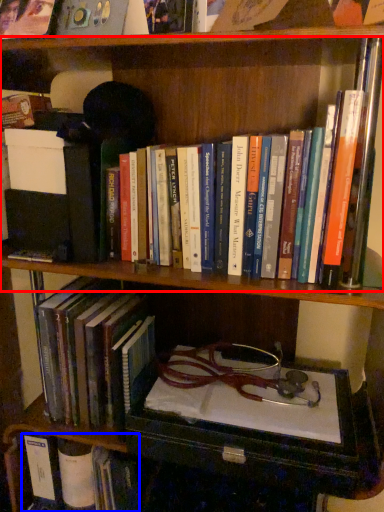
Question: Which point is closer to the camera, book (highlighted by a red box) or book (highlighted by a blue box)?

Choices:
 (A) book
 (B) book

Answer: (A)